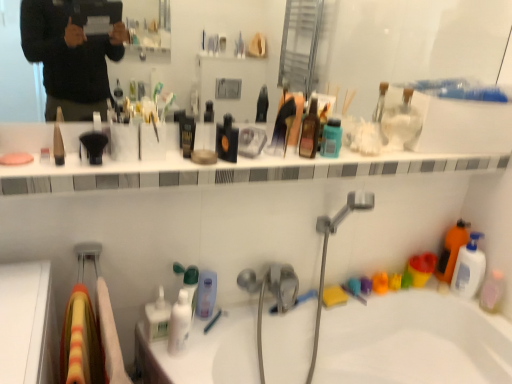
Locate an element on the screen. vacant area on top of white glossy ledge at upper center (from a real-world perspective) is located at coordinates (269, 161).